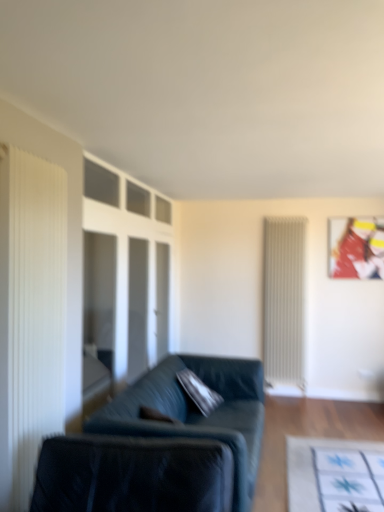
Question: From the image's perspective, is velvet dark green couch at center over white ribbed radiator at right?

Choices:
 (A) no
 (B) yes

Answer: (A)

Question: Is velvet dark green couch at center looking in the opposite direction of white ribbed radiator at right?

Choices:
 (A) no
 (B) yes

Answer: (A)

Question: From a real-world perspective, is velvet dark green couch at center beneath white ribbed radiator at right?

Choices:
 (A) no
 (B) yes

Answer: (B)

Question: Can you confirm if velvet dark green couch at center is wider than white ribbed radiator at right?

Choices:
 (A) yes
 (B) no

Answer: (A)

Question: Is velvet dark green couch at center to the right of white ribbed radiator at right from the viewer's perspective?

Choices:
 (A) no
 (B) yes

Answer: (A)

Question: Is velvet dark green couch at center not inside white ribbed radiator at right?

Choices:
 (A) yes
 (B) no

Answer: (A)

Question: Does white ribbed radiator at right have a greater height compared to velvet black swivel chair at lower left?

Choices:
 (A) no
 (B) yes

Answer: (B)

Question: Is white ribbed radiator at right facing away from velvet black swivel chair at lower left?

Choices:
 (A) no
 (B) yes

Answer: (A)

Question: Is white ribbed radiator at right at the right side of velvet black swivel chair at lower left?

Choices:
 (A) no
 (B) yes

Answer: (B)

Question: From the image's perspective, is white ribbed radiator at right located above velvet black swivel chair at lower left?

Choices:
 (A) yes
 (B) no

Answer: (A)

Question: Is white ribbed radiator at right not close to velvet black swivel chair at lower left?

Choices:
 (A) no
 (B) yes

Answer: (B)

Question: Is white ribbed radiator at right facing towards velvet black swivel chair at lower left?

Choices:
 (A) no
 (B) yes

Answer: (B)

Question: Is metallic glossy picture frame at upper right to the right of white pleated curtain at left from the viewer's perspective?

Choices:
 (A) no
 (B) yes

Answer: (B)